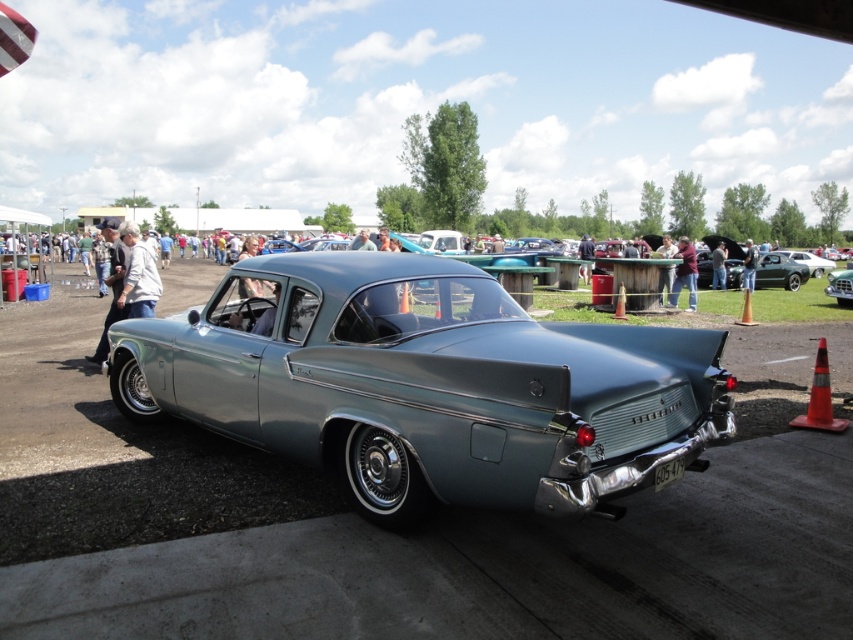
You are at a car show and see the blue fabric shirt at upper right and the orange cone at center. Which object is bigger?

The blue fabric shirt at upper right is larger in size compared to the orange cone at center.